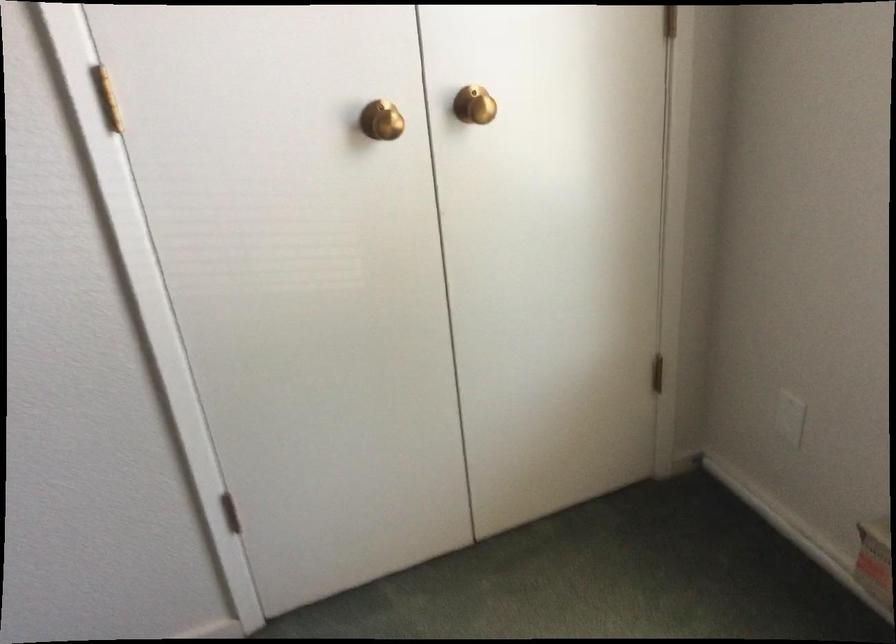
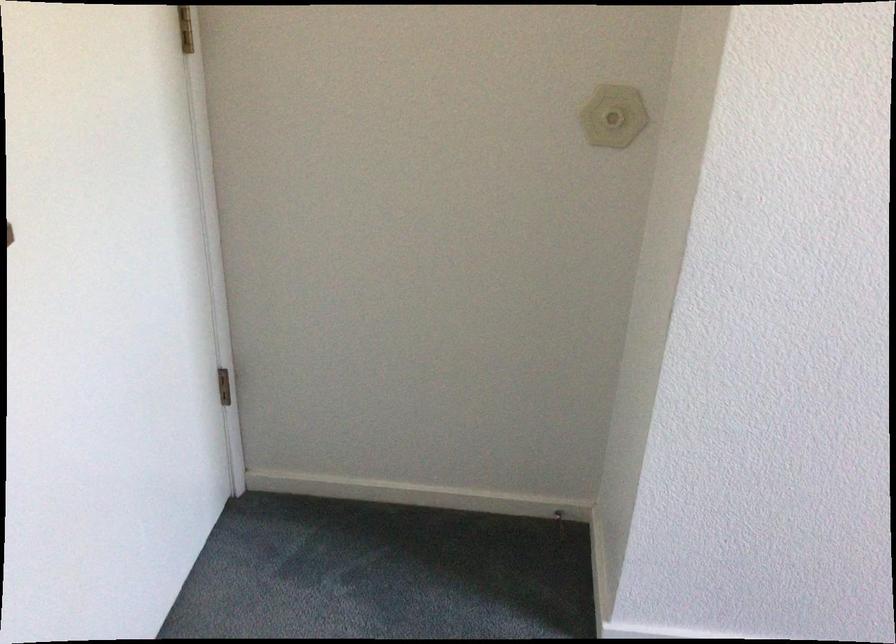
Question: What movement of the cameraman would produce the second image?

Choices:
 (A) Left
 (B) Right
 (C) Forward
 (D) Backward

Answer: (A)